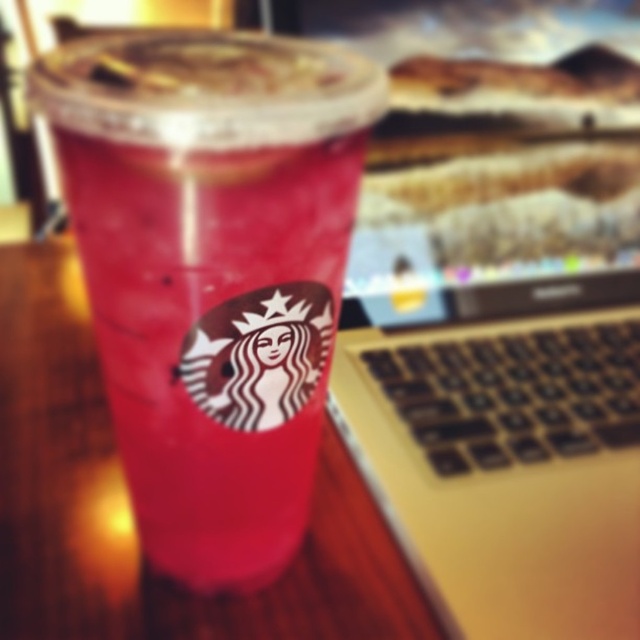
Question: In this image, where is silver metallic laptop at center located relative to pink paper cup at center?

Choices:
 (A) below
 (B) above

Answer: (B)

Question: Does silver metallic laptop at center appear under pink paper cup at center?

Choices:
 (A) yes
 (B) no

Answer: (B)

Question: Observing the image, what is the correct spatial positioning of silver metallic laptop at center in reference to pink paper cup at center?

Choices:
 (A) above
 (B) below

Answer: (A)

Question: Which of the following is the closest to the observer?

Choices:
 (A) (595, 109)
 (B) (134, 500)

Answer: (B)

Question: Which object is closer to the camera taking this photo?

Choices:
 (A) pink paper cup at center
 (B) silver metallic laptop at center

Answer: (A)